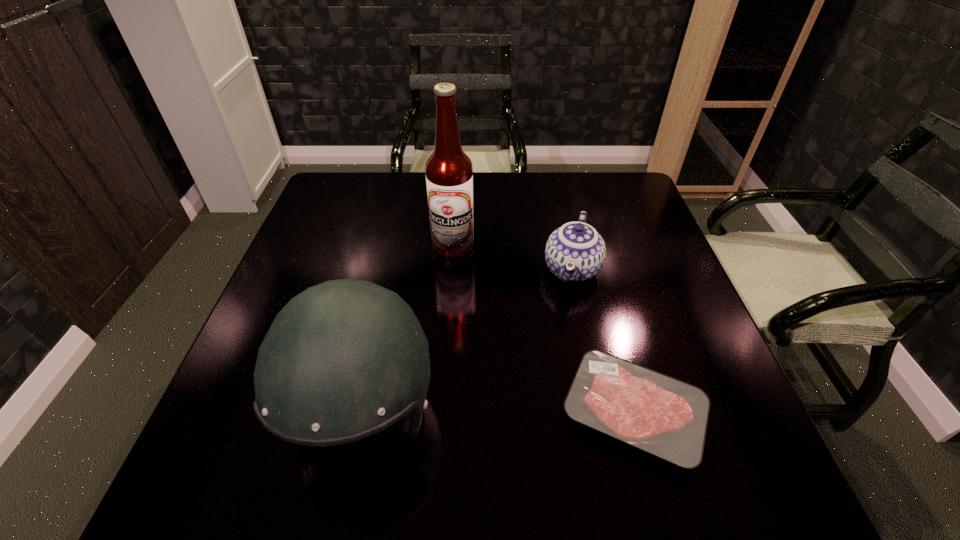
Locate an element on the screen. This screenshot has width=960, height=540. the second tallest object is located at coordinates (345, 359).

Find the location of `steak`. steak is located at coordinates (666, 417).

Where is `alcohol`? The height and width of the screenshot is (540, 960). alcohol is located at coordinates (449, 172).

Identify the location of chinaware. The height and width of the screenshot is (540, 960). (575, 252).

The width and height of the screenshot is (960, 540). Identify the location of free location located 0.310m on the back of the steak. (591, 260).

The width and height of the screenshot is (960, 540). I want to click on vacant area situated on the label side of the alcohol, so [x=486, y=346].

Locate an element on the screen. Image resolution: width=960 pixels, height=540 pixels. free space located on the label side of the alcohol is located at coordinates (475, 312).

What are the coordinates of `free spot located on the label side of the alcohol` in the screenshot? It's located at (484, 339).

Where is `free space located at the spout of the chinaware`? This screenshot has width=960, height=540. free space located at the spout of the chinaware is located at coordinates (555, 359).

What are the coordinates of `vacant space situated 0.090m at the spout of the chinaware` in the screenshot? It's located at pyautogui.click(x=563, y=330).